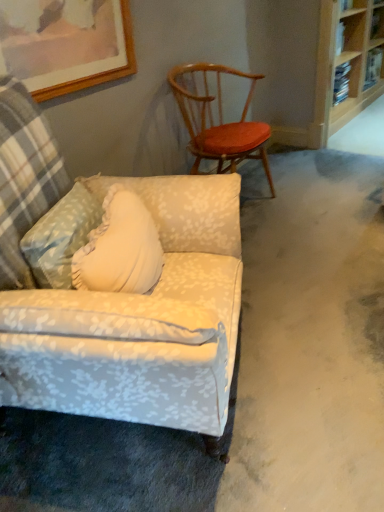
Question: Is floral fabric armchair at lower left, which is the 2th chair in back-to-front order, bigger or smaller than wooden bookshelf at upper right?

Choices:
 (A) small
 (B) big

Answer: (A)

Question: From the image's perspective, is floral fabric armchair at lower left, which appears as the first chair when viewed from the front, positioned above or below wooden bookshelf at upper right?

Choices:
 (A) below
 (B) above

Answer: (A)

Question: Which of these objects is positioned closest to the floral fabric armchair at lower left, which appears as the first chair when viewed from the front?

Choices:
 (A) wooden spindles chair at upper right, which is counted as the 2th chair, starting from the front
 (B) wooden picture frame at upper left
 (C) wooden bookshelf at upper right

Answer: (B)

Question: Estimate the real-world distances between objects in this image. Which object is farther from the wooden picture frame at upper left?

Choices:
 (A) wooden spindles chair at upper right, which appears as the first chair when viewed from the back
 (B) floral fabric armchair at lower left, which is the 2th chair in back-to-front order
 (C) wooden bookshelf at upper right

Answer: (C)